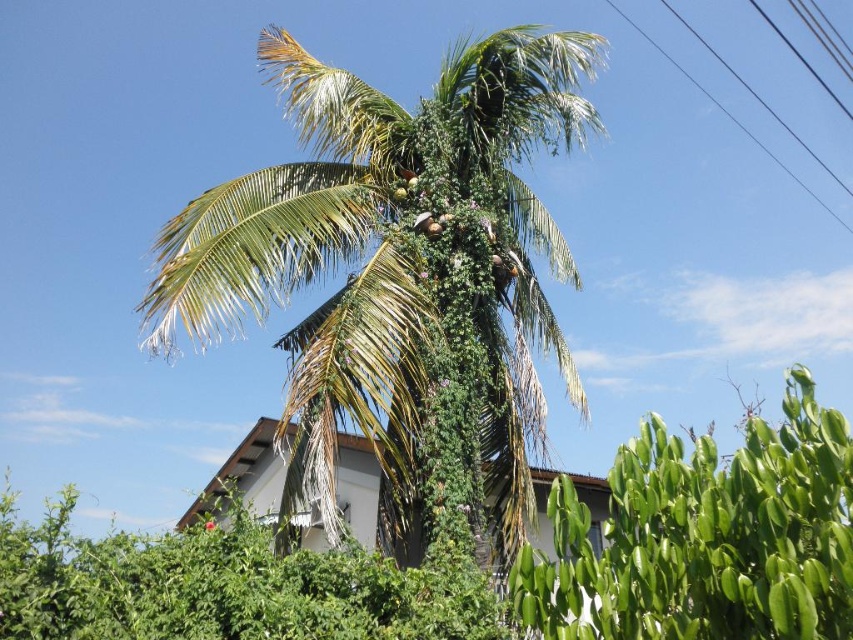
Who is higher up, green leafy bush at lower right or green leafy bush at lower left?

green leafy bush at lower right is above.

Which is in front, point (743, 600) or point (250, 557)?

Point (743, 600) is more forward.

At what (x,y) coordinates should I click in order to perform the action: click on green leafy bush at lower right. Please return your answer as a coordinate pair (x, y). The height and width of the screenshot is (640, 853). Looking at the image, I should click on (705, 538).

From the picture: Can you confirm if green leafy coconut tree at center is positioned to the right of green leafy bush at lower right?

In fact, green leafy coconut tree at center is to the left of green leafy bush at lower right.

Does point (292, 376) come farther from viewer compared to point (776, 464)?

Yes, it is.

Find the location of a particular element. This screenshot has height=640, width=853. green leafy coconut tree at center is located at coordinates (399, 280).

The image size is (853, 640). What do you see at coordinates (399, 280) in the screenshot?
I see `green leafy coconut tree at center` at bounding box center [399, 280].

Is green leafy coconut tree at center bigger than black wire at upper right?

No.

Which is behind, point (206, 196) or point (698, 83)?

The point (698, 83) is more distant.

Find the location of a particular element. Image resolution: width=853 pixels, height=640 pixels. green leafy coconut tree at center is located at coordinates (399, 280).